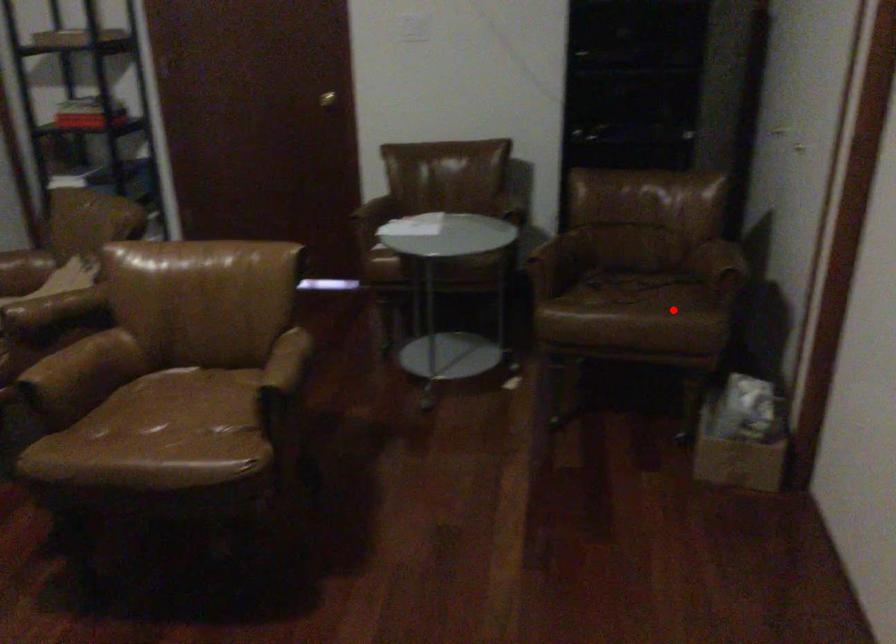
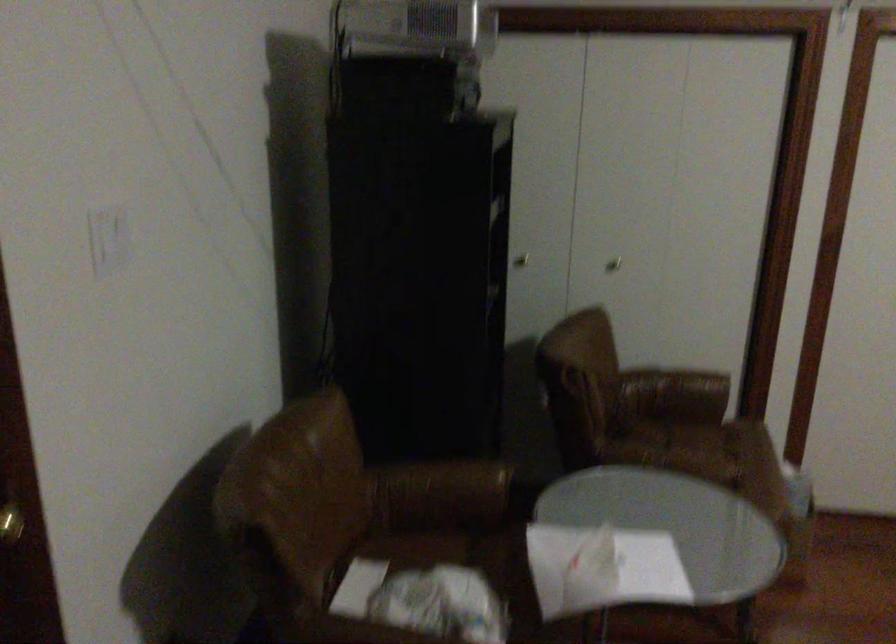
Find the pixel in the second image that matches the highlighted location in the first image.

(718, 442)